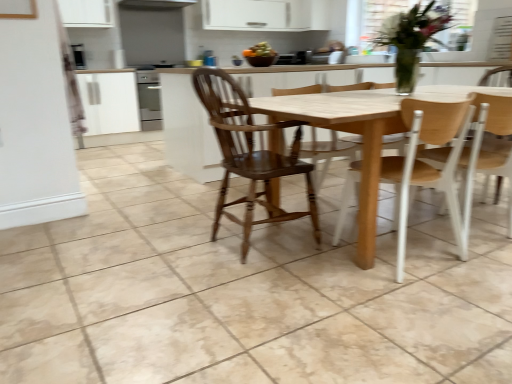
Question: In terms of width, does light brown wood chair at right, which is counted as the first chair, starting from the right, look wider or thinner when compared to light wood table at center?

Choices:
 (A) wide
 (B) thin

Answer: (B)

Question: From the image's perspective, relative to light wood table at center, is light brown wood chair at right, which appears as the third chair when viewed from the left, above or below?

Choices:
 (A) below
 (B) above

Answer: (A)

Question: Based on their relative distances, which object is nearer to the light brown wood chair at right, which appears as the third chair when viewed from the left?

Choices:
 (A) smooth orange fruit bowl at upper center
 (B) black glossy microwave at upper left
 (C) wooden chair at center, which is the 2th chair from right to left
 (D) wooden chair at center, which appears as the 3th chair when viewed from the right
 (E) light wood table at center

Answer: (C)

Question: Which object is the farthest from the light wood table at center?

Choices:
 (A) wooden chair at center, which appears as the 3th chair when viewed from the right
 (B) wooden chair at center, marked as the second chair in a left-to-right arrangement
 (C) smooth orange fruit bowl at upper center
 (D) light brown wood chair at right, which appears as the third chair when viewed from the left
 (E) black glossy microwave at upper left

Answer: (E)